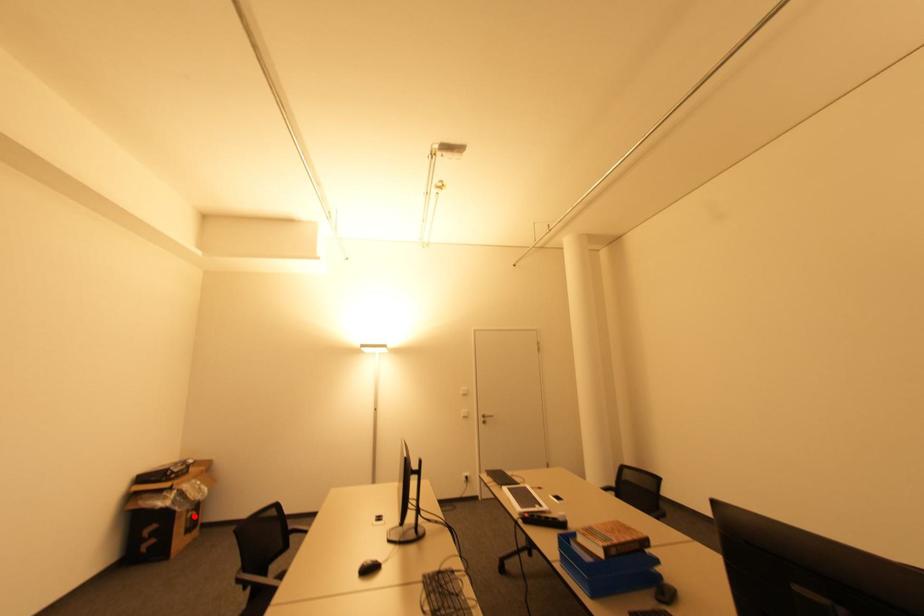
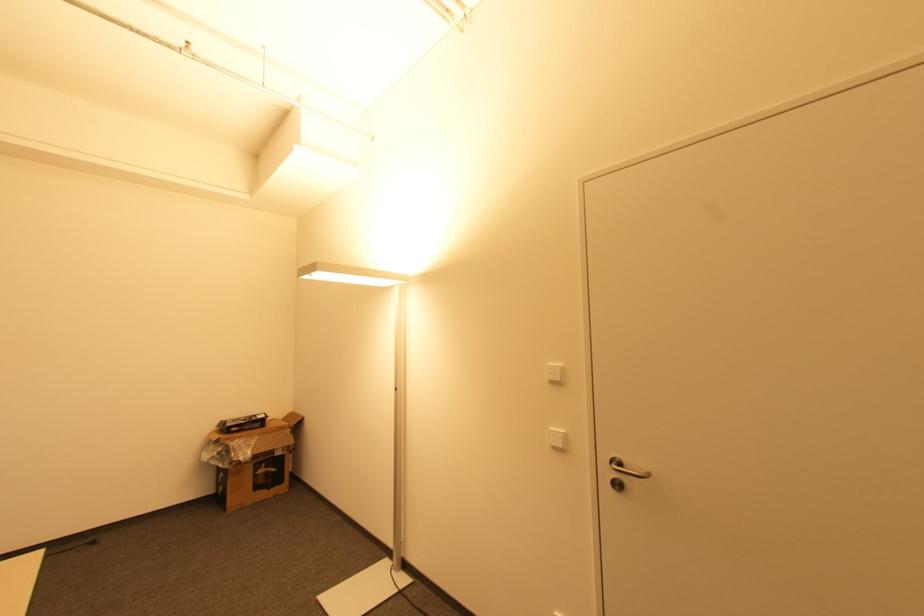
Where in the second image is the point corresponding to the highlighted location from the first image?

(268, 472)